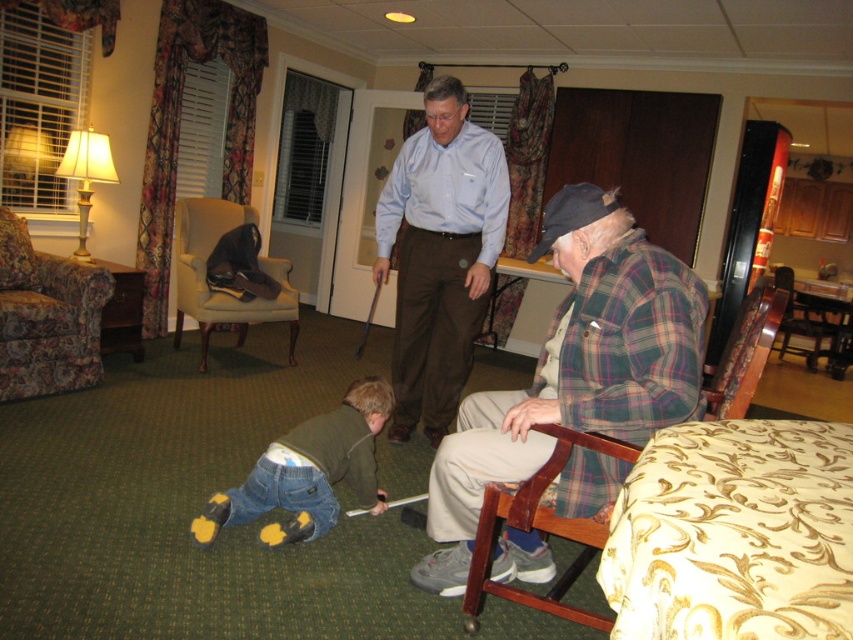
Which is in front, point (579, 538) or point (247, 211)?

Point (579, 538) is more forward.

Can you confirm if woodenchair at right is positioned to the left of dark brown leather armchair at left?

Incorrect, woodenchair at right is not on the left side of dark brown leather armchair at left.

Who is more distant from viewer, (558,433) or (282,264)?

The point (282,264) is behind.

This screenshot has width=853, height=640. I want to click on woodenchair at right, so (541, 531).

Who is shorter, light blue shirt at center or woodenchair at right?

woodenchair at right

Does point (469, 160) lie in front of point (624, 460)?

No.

Is point (426, 422) closer to viewer compared to point (521, 502)?

No, it is behind (521, 502).

Find the location of `light blue shirt at center`. light blue shirt at center is located at coordinates (439, 256).

Who is higher up, plaid flannel shirt at center or floral fabric armchair at left?

Positioned higher is floral fabric armchair at left.

Does point (459, 493) lie behind point (86, 323)?

No, it is not.

The height and width of the screenshot is (640, 853). I want to click on plaid flannel shirt at center, so click(x=573, y=369).

Locate an element on the screen. plaid flannel shirt at center is located at coordinates (x=573, y=369).